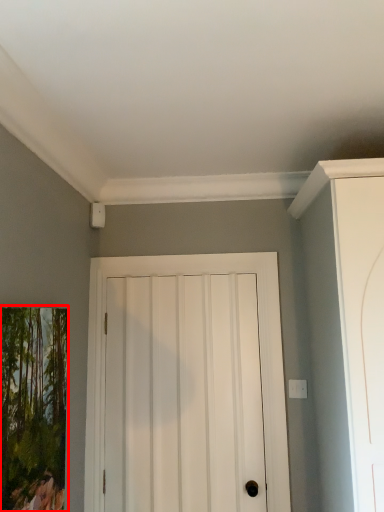
Question: Where is picture frame (annotated by the red box) located in relation to door in the image?

Choices:
 (A) left
 (B) right

Answer: (A)